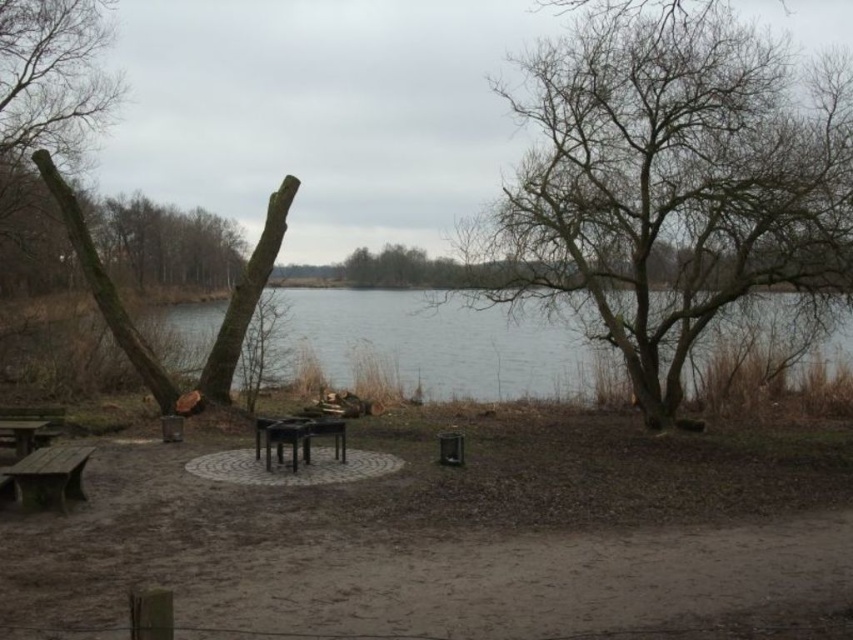
The image size is (853, 640). What do you see at coordinates (105, 288) in the screenshot? I see `brown rough wood at left` at bounding box center [105, 288].

Between brown rough wood at left and brown wooden table at lower left, which one has more height?

With more height is brown rough wood at left.

Locate an element on the screen. brown rough wood at left is located at coordinates (105, 288).

Looking at this image, between bare wood tree at upper right and wooden bench at lower left, which one appears on the right side from the viewer's perspective?

From the viewer's perspective, bare wood tree at upper right appears more on the right side.

Does bare wood tree at upper right appear on the right side of wooden bench at lower left?

Indeed, bare wood tree at upper right is positioned on the right side of wooden bench at lower left.

Between point (791, 102) and point (25, 481), which one is positioned in front?

Point (25, 481) is more forward.

Where is `bare wood tree at upper right`? bare wood tree at upper right is located at coordinates (670, 184).

Is point (259, 260) positioned before point (64, 483)?

No.

Is brown rough wood at left to the right of wooden bench at lower left from the viewer's perspective?

No, brown rough wood at left is not to the right of wooden bench at lower left.

You are a GUI agent. You are given a task and a screenshot of the screen. Output one action in this format:
    pyautogui.click(x=<x>, y=<y>)
    Task: Click on the brown rough wood at left
    Image resolution: width=853 pixels, height=640 pixels.
    Given the screenshot: What is the action you would take?
    pyautogui.click(x=105, y=288)